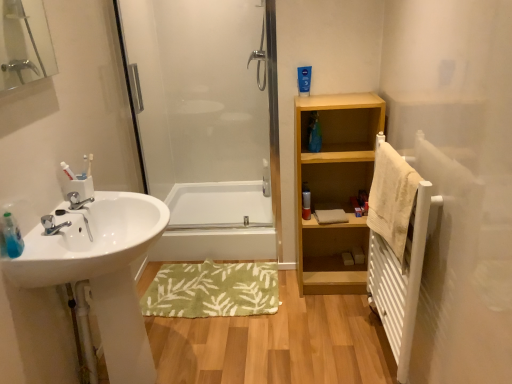
Where is `white metallic radiator at right`? Image resolution: width=512 pixels, height=384 pixels. white metallic radiator at right is located at coordinates (400, 278).

What is the approximate width of white metallic radiator at right?

white metallic radiator at right is 13.65 centimeters in width.

In order to face green soft bath mat at center, should I rotate leftwards or rightwards?

Turn left approximately 5.040 degrees to face it.

In order to face white glossy sink at left, should I rotate leftwards or rightwards?

To align with it, rotate left about 17.172°.

This screenshot has width=512, height=384. What do you see at coordinates (306, 201) in the screenshot? I see `matte silver canister at center` at bounding box center [306, 201].

Locate an element on the screen. matte silver canister at center is located at coordinates (306, 201).

Measure the distance between white glossy bathtub at center and camera.

white glossy bathtub at center and camera are 2.66 meters apart from each other.

The width and height of the screenshot is (512, 384). What do you see at coordinates (335, 187) in the screenshot?
I see `light wood shelf at center right` at bounding box center [335, 187].

The image size is (512, 384). In order to click on silver metallic faucet at sink left in this screenshot , I will do `click(77, 201)`.

Based on the photo, what is the approximate width of transparent glass shower door at center?

transparent glass shower door at center is 4.07 inches wide.

At what (x,y) coordinates should I click in order to perform the action: click on white metallic radiator at right. Please return your answer as a coordinate pair (x, y). The width and height of the screenshot is (512, 384). Looking at the image, I should click on (400, 278).

Measure the distance from white glossy bathtub at center to white glossy sink at left.

white glossy bathtub at center and white glossy sink at left are 1.11 meters apart from each other.

Locate an element on the screen. Image resolution: width=512 pixels, height=384 pixels. bath behind the white glossy sink at left is located at coordinates (217, 223).

From the image's perspective, which object appears higher, white glossy bathtub at center or white glossy sink at left?

white glossy bathtub at center is shown above in the image.

Is there a large distance between white glossy bathtub at center and white glossy sink at left?

white glossy bathtub at center is far away from white glossy sink at left.

Does light wood shelf at center right lie behind white metallic radiator at right?

Yes.

Is light wood shelf at center right not near white metallic radiator at right?

No, light wood shelf at center right is not far from white metallic radiator at right.

Which is in front, point (376, 258) or point (166, 239)?

Positioned in front is point (376, 258).

From a real-world perspective, which object stands above the other?

white metallic radiator at right.

How different are the orientations of white metallic radiator at right and white glossy bathtub at center in degrees?

87.1 degrees.

Does white metallic radiator at right have a greater height compared to white glossy bathtub at center?

Yes, white metallic radiator at right is taller than white glossy bathtub at center.

Does point (375, 166) appear closer or farther from the camera than point (77, 200)?

Point (375, 166) appears to be farther away from the viewer than point (77, 200).

Considering the sizes of objects beige textured towel at right and silver metallic faucet at sink left in the image provided, who is bigger, beige textured towel at right or silver metallic faucet at sink left?

With larger size is beige textured towel at right.

Considering the sizes of objects beige textured towel at right and silver metallic faucet at sink left in the image provided, who is shorter, beige textured towel at right or silver metallic faucet at sink left?

With less height is silver metallic faucet at sink left.

From a real-world perspective, is beige textured towel at right below silver metallic faucet at sink left?

Yes.

From the image's perspective, is green soft bath mat at center above or below transparent glass shower door at center?

green soft bath mat at center is situated lower than transparent glass shower door at center in the image.

In the scene shown: Considering the relative sizes of green soft bath mat at center and transparent glass shower door at center in the image provided, is green soft bath mat at center wider than transparent glass shower door at center?

Correct, the width of green soft bath mat at center exceeds that of transparent glass shower door at center.

I want to click on screen door located above the green soft bath mat at center (from the image's perspective), so click(x=201, y=123).

Can you confirm if green soft bath mat at center is smaller than transparent glass shower door at center?

Indeed, green soft bath mat at center has a smaller size compared to transparent glass shower door at center.

Based on their positions, is white glossy bathtub at center located to the left or right of green soft bath mat at center?

white glossy bathtub at center is to the left of green soft bath mat at center.

Would you consider white glossy bathtub at center to be distant from green soft bath mat at center?

white glossy bathtub at center is near green soft bath mat at center, not far away.

Is white glossy bathtub at center wider or thinner than green soft bath mat at center?

white glossy bathtub at center is wider than green soft bath mat at center.

From a real-world perspective, is white glossy bathtub at center on top of green soft bath mat at center?

Correct, in the physical world, white glossy bathtub at center is higher than green soft bath mat at center.

In the image, is beige textured towel at right on the left side or the right side of green soft bath mat at center?

Clearly, beige textured towel at right is on the right of green soft bath mat at center in the image.

Is beige textured towel at right closer to the viewer compared to green soft bath mat at center?

Yes, beige textured towel at right is closer to the viewer.

From a real-world perspective, is beige textured towel at right above or below green soft bath mat at center?

From a real-world perspective, beige textured towel at right is physically above green soft bath mat at center.

Is beige textured towel at right looking in the opposite direction of green soft bath mat at center?

That's not correct — beige textured towel at right is not looking away from green soft bath mat at center.

In order to click on bath above the white glossy sink at left (from the image's perspective) in this screenshot , I will do `click(217, 223)`.

Where is `bathroom cabinet above the white metallic radiator at right (from a real-world perspective)`? This screenshot has width=512, height=384. bathroom cabinet above the white metallic radiator at right (from a real-world perspective) is located at coordinates coord(335,187).

Based on their spatial positions, is silver metallic faucet at sink left or light wood shelf at center right further from white glossy sink at left?

Based on the image, light wood shelf at center right appears to be further to white glossy sink at left.

Based on their spatial positions, is transparent glass shower door at center or white glossy bathtub at center further from silver metallic faucet at sink left?

transparent glass shower door at center lies further to silver metallic faucet at sink left than the other object.

Which object lies further to the anchor point silver metallic faucet at sink left, light wood shelf at center right or transparent glass shower door at center?

The object further to silver metallic faucet at sink left is transparent glass shower door at center.

From the image, which object appears to be farther from white metallic radiator at right, silver metallic faucet at sink left or green soft bath mat at center?

Based on the image, silver metallic faucet at sink left appears to be further to white metallic radiator at right.

Estimate the real-world distances between objects in this image. Which object is further from white metallic radiator at right, green soft bath mat at center or transparent glass shower door at center?

transparent glass shower door at center lies further to white metallic radiator at right than the other object.

Consider the image. Based on their spatial positions, is green soft bath mat at center or beige textured towel at right closer to matte silver canister at center?

Based on the image, green soft bath mat at center appears to be nearer to matte silver canister at center.

When comparing their distances from white glossy sink at left, does white glossy bathtub at center or light wood shelf at center right seem closer?

light wood shelf at center right is closer to white glossy sink at left.

From the image, which object appears to be farther from green soft bath mat at center, white metallic radiator at right or matte silver canister at center?

Among the two, white metallic radiator at right is located further to green soft bath mat at center.

Find the location of a particular element. The height and width of the screenshot is (384, 512). sink between silver metallic faucet at sink left and white metallic radiator at right from left to right is located at coordinates click(x=101, y=271).

I want to click on toiletry positioned between white metallic radiator at right and white glossy bathtub at center from near to far, so tap(306, 201).

You are a GUI agent. You are given a task and a screenshot of the screen. Output one action in this format:
    pyautogui.click(x=<x>, y=<y>)
    Task: Click on the screen door situated between white glossy sink at left and beige textured towel at right from left to right
    This screenshot has height=384, width=512.
    Given the screenshot: What is the action you would take?
    pyautogui.click(x=201, y=123)

The image size is (512, 384). Identify the location of bath mat between white glossy sink at left and white metallic radiator at right from left to right. (212, 290).